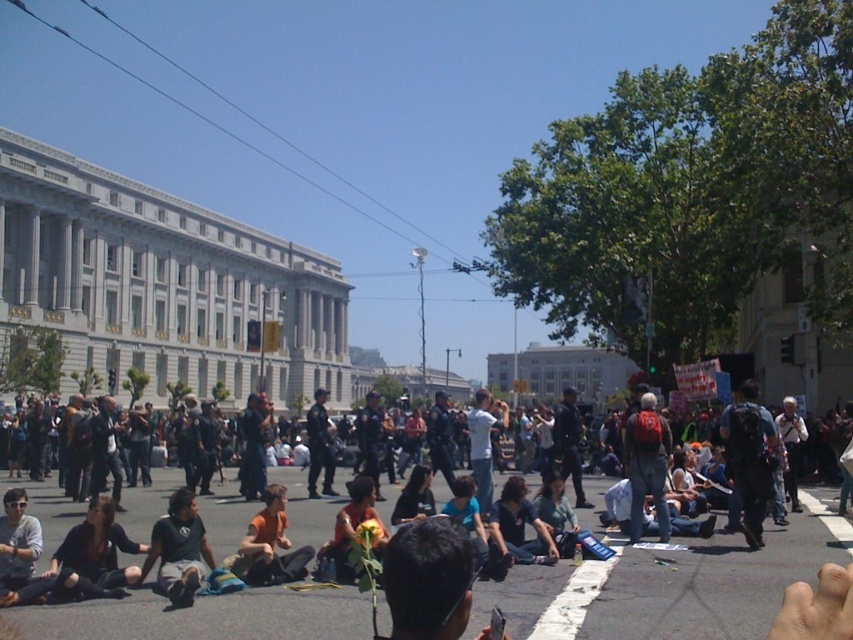
What is the 2D coordinate of the dark hair at center?

The dark hair at center is located at the 2D coordinate point of (428, 579).

You are standing at the center of the image and want to move towards the dark blue jeans at lower center. Which direction should you move in to reach them?

To reach the dark blue jeans at lower center, you should move downward and to the right since their 2D coordinates are at point 0.920 on the x axis and 0.775 on the y axis, which is lower and to the right from the center of the image.